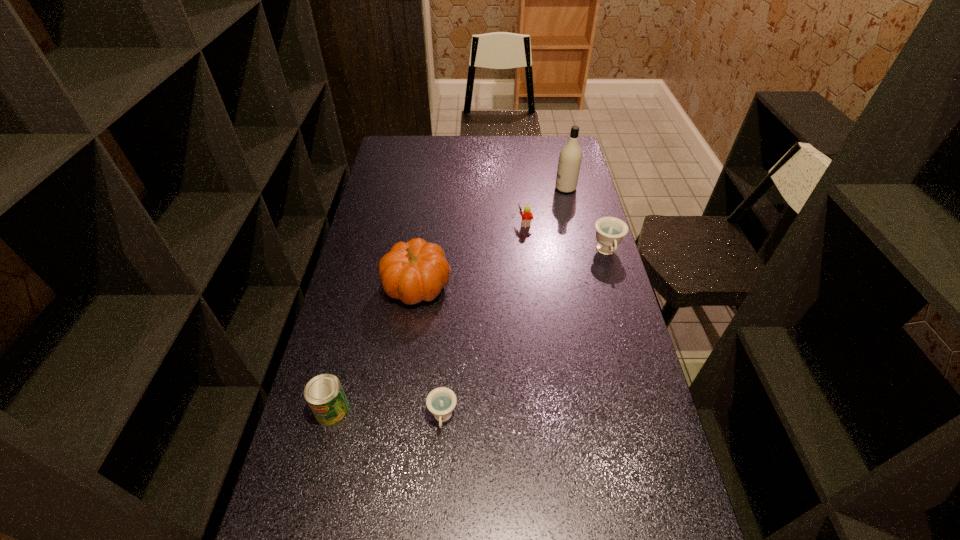
You are a GUI agent. You are given a task and a screenshot of the screen. Output one action in this format:
    pyautogui.click(x=<x>, y=<y>)
    Task: Click on the spot to insert another teacup for uniform distribution
    The image size is (960, 540).
    Given the screenshot: What is the action you would take?
    pyautogui.click(x=538, y=321)